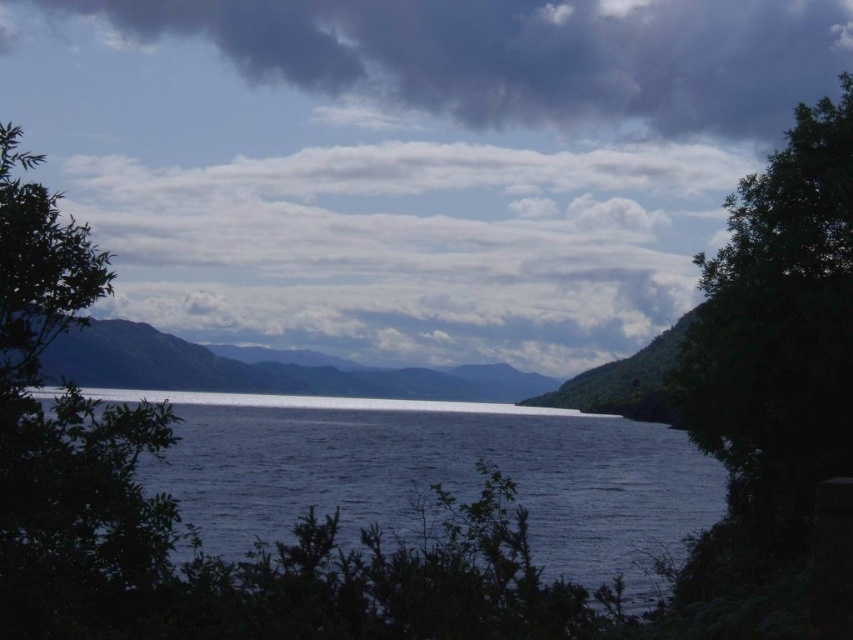
You are standing in the serene landscape scene looking at the lake. There are two points marked in the image, one at coordinates point [73,250] and another at point [296,355]. Which of these points is nearer to your viewpoint?

Point [73,250] is closer to the camera than point [296,355], so the point at coordinates point [73,250] is nearer to your viewpoint.

Based on the scene description and the coordinates provided, what does the point at coordinates (x=434, y=470) represent in the image?

The point at coordinates (x=434, y=470) represents dark blue water at center.

You are standing in the serene landscape looking at the dark gray cloud at upper center and the green leafy tree at right. Which object is positioned to the left of the other?

The dark gray cloud at upper center is to the left of the green leafy tree at right.